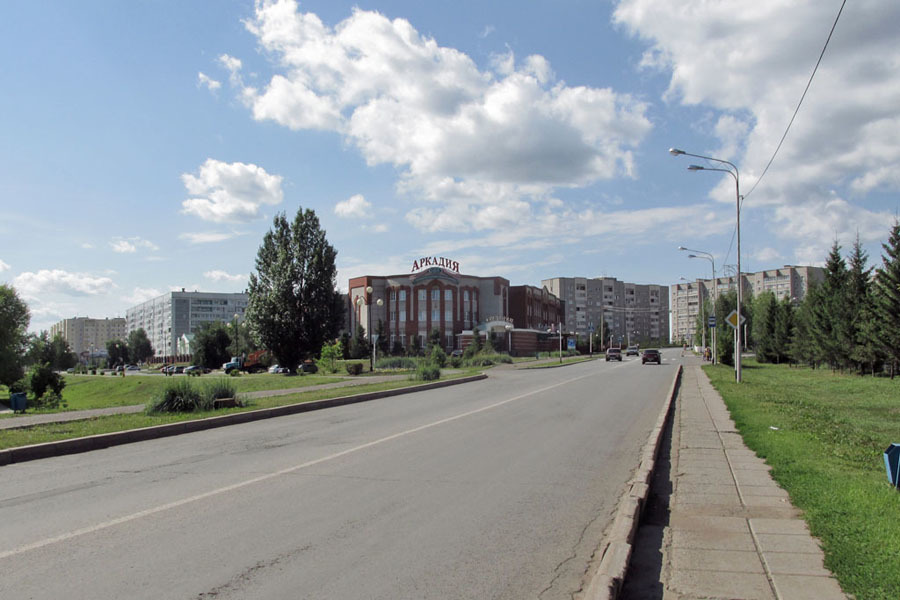
In order to click on light in this screenshot , I will do `click(670, 153)`.